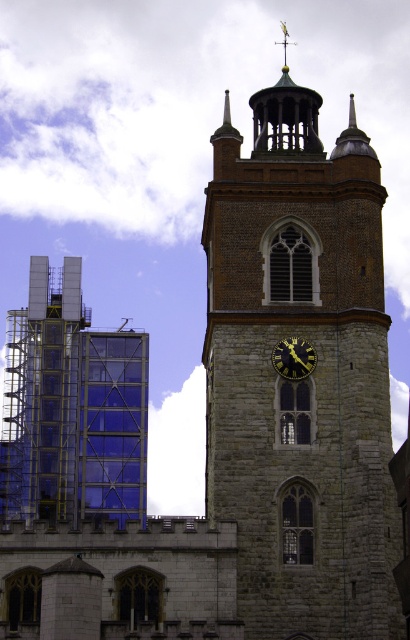
You are an architect evaluating the spatial compatibility between the transparent glass building at left and the gold metallic clock at center. Based on their widths, which one could potentially occupy more floor space in the city layout?

The transparent glass building at left might be wider than gold metallic clock at center, so it could potentially occupy more floor space in the city layout.

You are a city planner assessing the impact of new construction on historical landmarks. The stone clock tower at center and the transparent glass building at left are both visible from a nearby park. Which structure would appear larger in the park visitor view, based on their widths?

The stone clock tower at center might be wider than transparent glass building at left, so it would likely appear larger in the park visitor view.

You are an architect comparing the stone clock tower at center and the transparent glass building at left. Which one has a greater overall height?

The stone clock tower at center is larger in size than the transparent glass building at left, so it has a greater overall height.